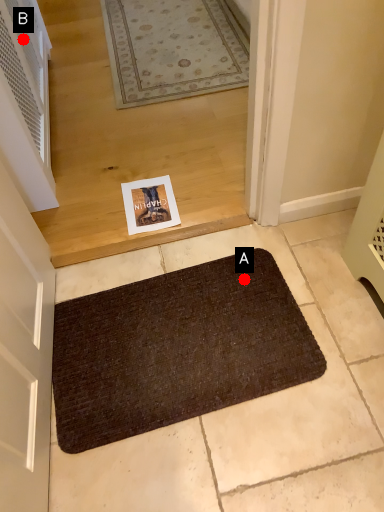
Question: Two points are circled on the image, labeled by A and B beside each circle. Among these points, which one is nearest to the camera?

Choices:
 (A) A is closer
 (B) B is closer

Answer: (A)